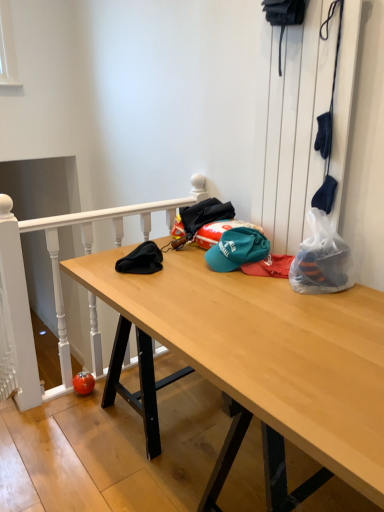
Question: Considering the relative sizes of white wood rail at upper left and light wood desk at center in the image provided, is white wood rail at upper left taller than light wood desk at center?

Choices:
 (A) yes
 (B) no

Answer: (A)

Question: Would you say light wood desk at center is part of white wood rail at upper left's contents?

Choices:
 (A) yes
 (B) no

Answer: (B)

Question: Does white wood rail at upper left have a greater width compared to light wood desk at center?

Choices:
 (A) yes
 (B) no

Answer: (B)

Question: Considering the relative sizes of white wood rail at upper left and light wood desk at center in the image provided, is white wood rail at upper left smaller than light wood desk at center?

Choices:
 (A) no
 (B) yes

Answer: (B)

Question: Is white wood rail at upper left at the right side of light wood desk at center?

Choices:
 (A) yes
 (B) no

Answer: (B)

Question: Considering the relative sizes of white wood rail at upper left and light wood desk at center in the image provided, is white wood rail at upper left thinner than light wood desk at center?

Choices:
 (A) yes
 (B) no

Answer: (A)

Question: Is teal fabric cap at center oriented towards white wood rail at upper left?

Choices:
 (A) yes
 (B) no

Answer: (B)

Question: Considering the relative positions of teal fabric cap at center and white wood rail at upper left in the image provided, is teal fabric cap at center to the right of white wood rail at upper left from the viewer's perspective?

Choices:
 (A) yes
 (B) no

Answer: (A)

Question: Does teal fabric cap at center have a smaller size compared to white wood rail at upper left?

Choices:
 (A) yes
 (B) no

Answer: (A)

Question: Does teal fabric cap at center have a greater width compared to white wood rail at upper left?

Choices:
 (A) no
 (B) yes

Answer: (B)

Question: Considering the relative sizes of teal fabric cap at center and white wood rail at upper left in the image provided, is teal fabric cap at center bigger than white wood rail at upper left?

Choices:
 (A) no
 (B) yes

Answer: (A)

Question: Does teal fabric cap at center lie in front of white wood rail at upper left?

Choices:
 (A) no
 (B) yes

Answer: (B)

Question: Does teal fabric cap at center have a larger size compared to light wood desk at center?

Choices:
 (A) no
 (B) yes

Answer: (A)